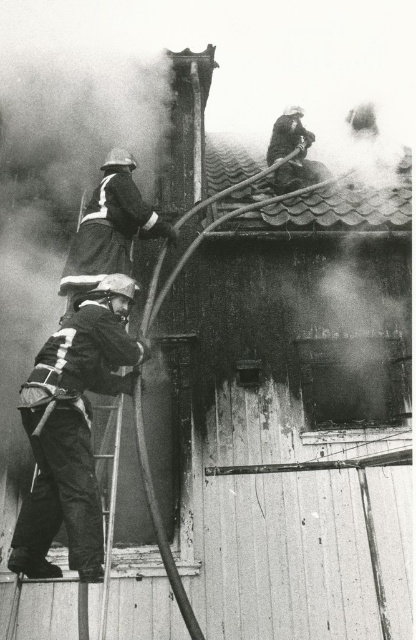
Does black matte uniform at lower left appear on the right side of dark gray uniform at center?

No, black matte uniform at lower left is not to the right of dark gray uniform at center.

Between black matte uniform at lower left and dark gray uniform at center, which one has less height?

dark gray uniform at center

The height and width of the screenshot is (640, 416). What do you see at coordinates (71, 429) in the screenshot? I see `black matte uniform at lower left` at bounding box center [71, 429].

Find the location of a particular element. Image resolution: width=416 pixels, height=640 pixels. black matte uniform at lower left is located at coordinates (71, 429).

Does black matte uniform at lower left have a smaller size compared to metallic silver ladder at lower center?

Incorrect, black matte uniform at lower left is not smaller in size than metallic silver ladder at lower center.

The image size is (416, 640). What do you see at coordinates (71, 429) in the screenshot?
I see `black matte uniform at lower left` at bounding box center [71, 429].

Where is `black matte uniform at lower left`? black matte uniform at lower left is located at coordinates (71, 429).

Between black matte uniform at lower left and shiny tiled roof at upper center, which one appears on the left side from the viewer's perspective?

From the viewer's perspective, black matte uniform at lower left appears more on the left side.

What do you see at coordinates (71, 429) in the screenshot? I see `black matte uniform at lower left` at bounding box center [71, 429].

Does point (89, 349) come behind point (269, 211)?

No, (89, 349) is in front of (269, 211).

The width and height of the screenshot is (416, 640). Identify the location of black matte uniform at lower left. (71, 429).